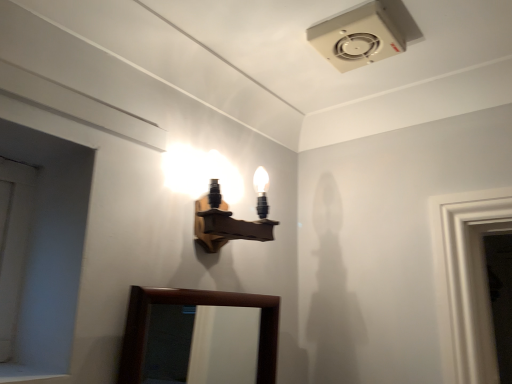
Question: Can you confirm if white matte door at left is smaller than wooden wall sconce at upper center?

Choices:
 (A) yes
 (B) no

Answer: (A)

Question: Is white matte door at left to the right of wooden wall sconce at upper center from the viewer's perspective?

Choices:
 (A) yes
 (B) no

Answer: (B)

Question: Is white matte door at left thinner than wooden wall sconce at upper center?

Choices:
 (A) no
 (B) yes

Answer: (B)

Question: Can you confirm if white matte door at left is shorter than wooden wall sconce at upper center?

Choices:
 (A) yes
 (B) no

Answer: (B)

Question: Is white matte door at left facing towards wooden wall sconce at upper center?

Choices:
 (A) yes
 (B) no

Answer: (B)

Question: Is white matte door at left behind wooden wall sconce at upper center?

Choices:
 (A) no
 (B) yes

Answer: (A)

Question: Can you confirm if wooden wall sconce at upper center is wider than brown wooden mirror at lower center?

Choices:
 (A) no
 (B) yes

Answer: (B)

Question: Considering the relative sizes of wooden wall sconce at upper center and brown wooden mirror at lower center in the image provided, is wooden wall sconce at upper center shorter than brown wooden mirror at lower center?

Choices:
 (A) yes
 (B) no

Answer: (A)

Question: Would you say wooden wall sconce at upper center is outside brown wooden mirror at lower center?

Choices:
 (A) no
 (B) yes

Answer: (B)

Question: Is brown wooden mirror at lower center at the back of wooden wall sconce at upper center?

Choices:
 (A) no
 (B) yes

Answer: (A)

Question: Would you consider wooden wall sconce at upper center to be distant from brown wooden mirror at lower center?

Choices:
 (A) no
 (B) yes

Answer: (A)

Question: From a real-world perspective, is wooden wall sconce at upper center positioned under brown wooden mirror at lower center based on gravity?

Choices:
 (A) yes
 (B) no

Answer: (B)

Question: Considering the relative positions of brown wooden mirror at lower center and wooden wall sconce at upper center in the image provided, is brown wooden mirror at lower center behind wooden wall sconce at upper center?

Choices:
 (A) yes
 (B) no

Answer: (B)